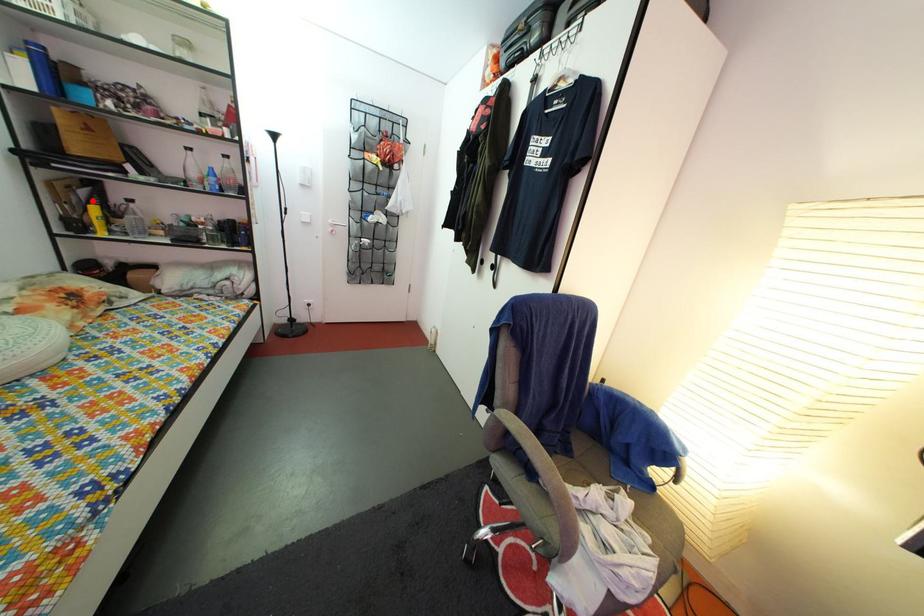
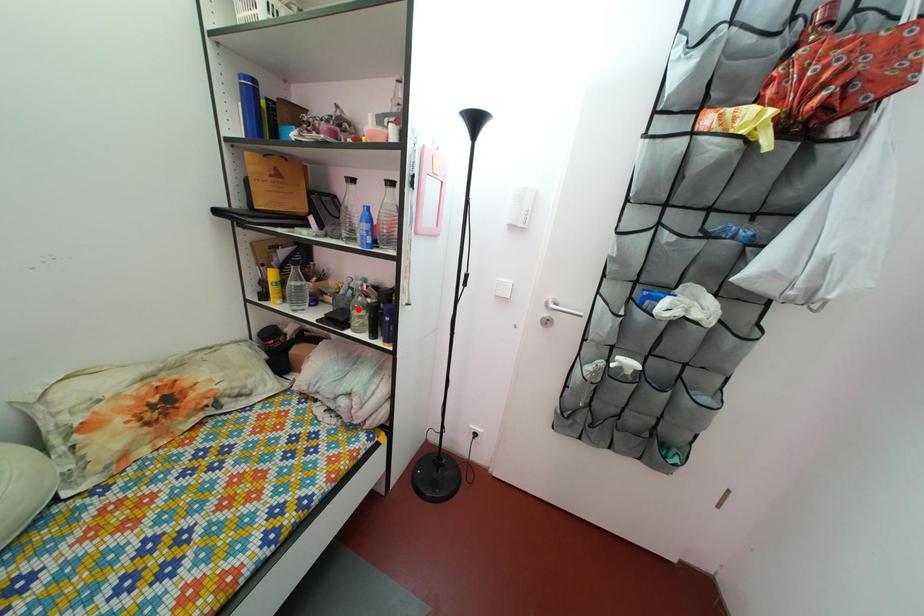
I am providing you with two images of the same scene from different viewpoints. A red point is marked on the first image and another point is marked on the second image. Does the point marked in image1 correspond to the same location as the one in image2?

No